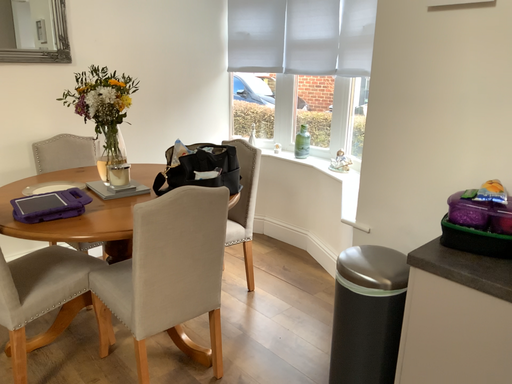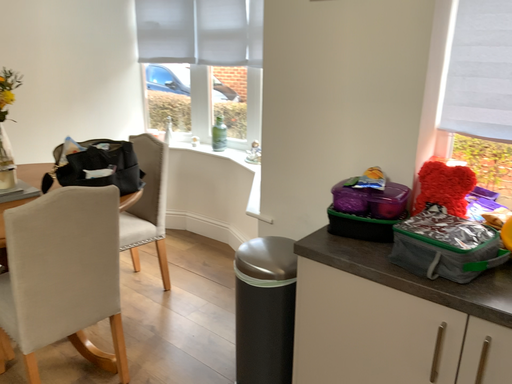
Question: How did the camera likely rotate when shooting the video?

Choices:
 (A) rotated left
 (B) rotated right

Answer: (B)